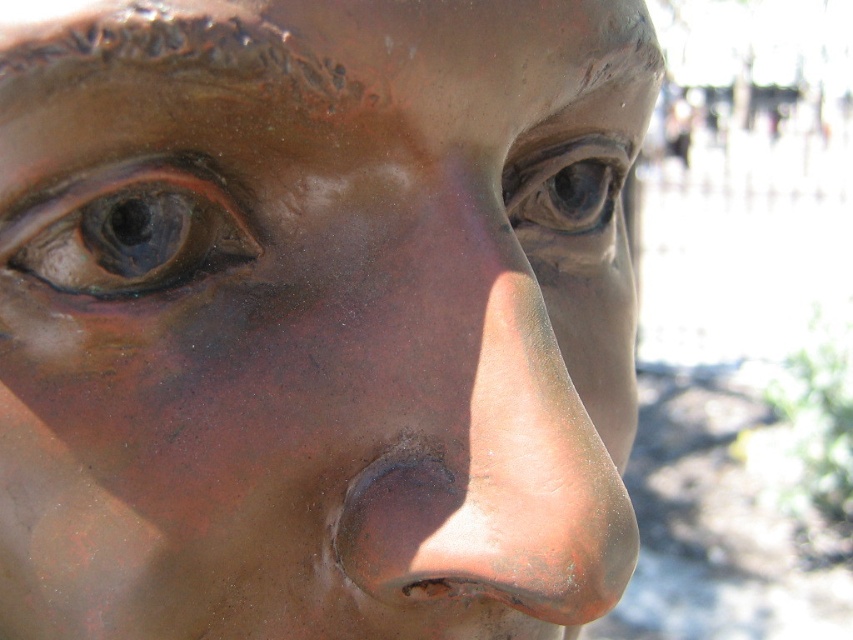
You are an art conservator examining the sculpture. You need to determine which object has a greater width between the bronze textured nose at center and the shiny bronze eye at upper left. Based on the sculpture, which one is wider?

The bronze textured nose at center is wider than the shiny bronze eye at upper left.

In the scene shown: You are an art conservator examining the bronze sculpture. You notice two eyes on the sculpture. The shiny bronze eye at upper left and the matte bronze eye at center. Which eye is positioned to the left side of the other?

The shiny bronze eye at upper left is positioned to the left of the matte bronze eye at center.